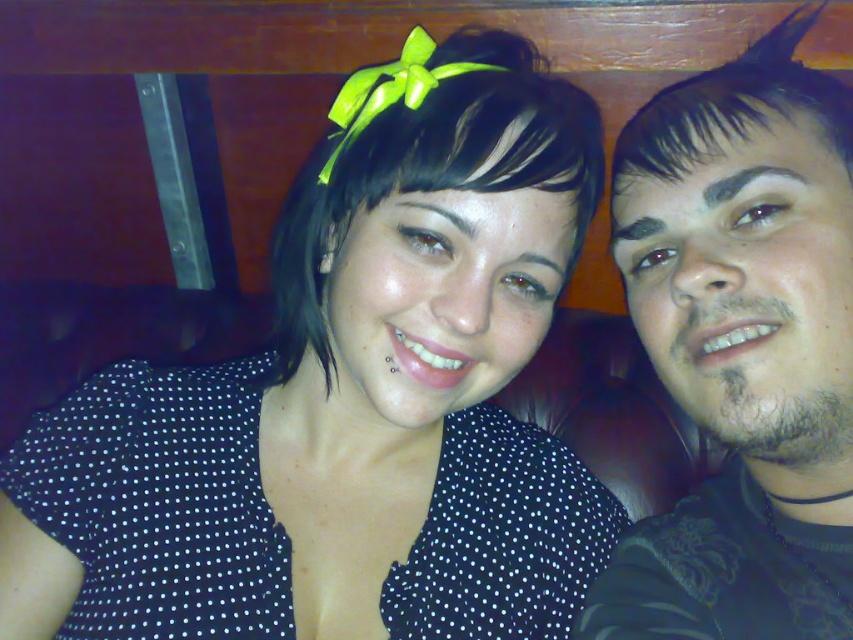
Question: Does black shiny hair at center have a greater width compared to dark brown shiny hair at upper right?

Choices:
 (A) no
 (B) yes

Answer: (B)

Question: Is black dotted shirt at center thinner than black matte shirt at right?

Choices:
 (A) yes
 (B) no

Answer: (B)

Question: Estimate the real-world distances between objects in this image. Which object is closer to the black shiny hair at center?

Choices:
 (A) black matte shirt at right
 (B) black dotted shirt at center

Answer: (B)

Question: Which point is farther to the camera?

Choices:
 (A) 415,29
 (B) 675,337
 (C) 792,97
 (D) 549,150

Answer: (A)

Question: Which object is positioned closest to the black matte shirt at right?

Choices:
 (A) black dotted shirt at center
 (B) black shiny hair at center

Answer: (B)

Question: Is black shiny hair at center bigger than dark brown shiny hair at upper right?

Choices:
 (A) yes
 (B) no

Answer: (A)